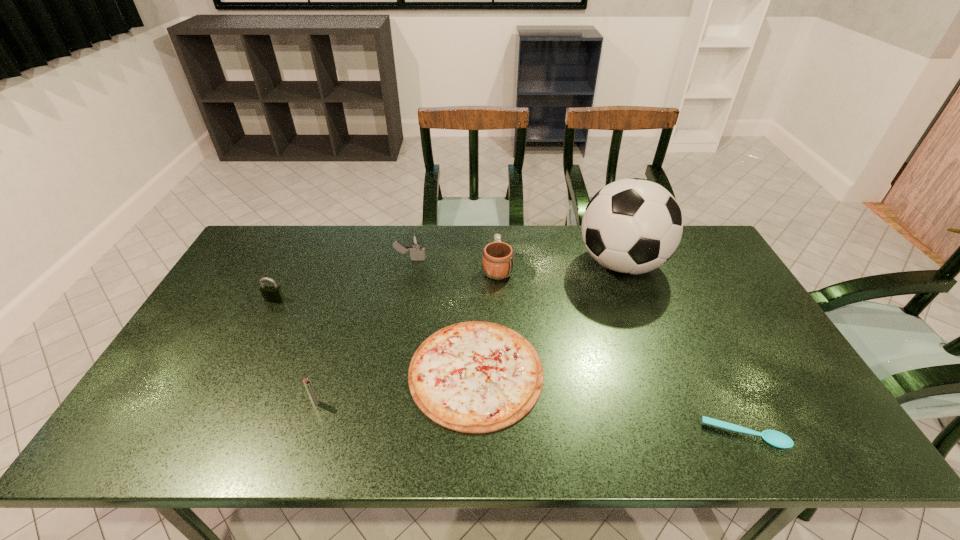
This screenshot has width=960, height=540. Identify the location of the tallest object. (632, 226).

Find the location of a particular element. This screenshot has width=960, height=540. the right igniter is located at coordinates (415, 246).

Find the location of a particular element. This screenshot has width=960, height=540. the farther igniter is located at coordinates (415, 246).

Identify the location of mug. The image size is (960, 540). (498, 257).

Where is `the leftmost object`? This screenshot has height=540, width=960. the leftmost object is located at coordinates (273, 294).

Locate an element on the screen. The height and width of the screenshot is (540, 960). the fourth nearest object is located at coordinates (273, 294).

Image resolution: width=960 pixels, height=540 pixels. In order to click on the sixth object from right to left in this screenshot , I will do `click(307, 383)`.

Find the location of a particular element. Image resolution: width=960 pixels, height=540 pixels. the nearer igniter is located at coordinates (307, 383).

What are the coordinates of `pizza` in the screenshot? It's located at (473, 377).

Locate an element on the screen. This screenshot has height=540, width=960. the shortest object is located at coordinates (777, 439).